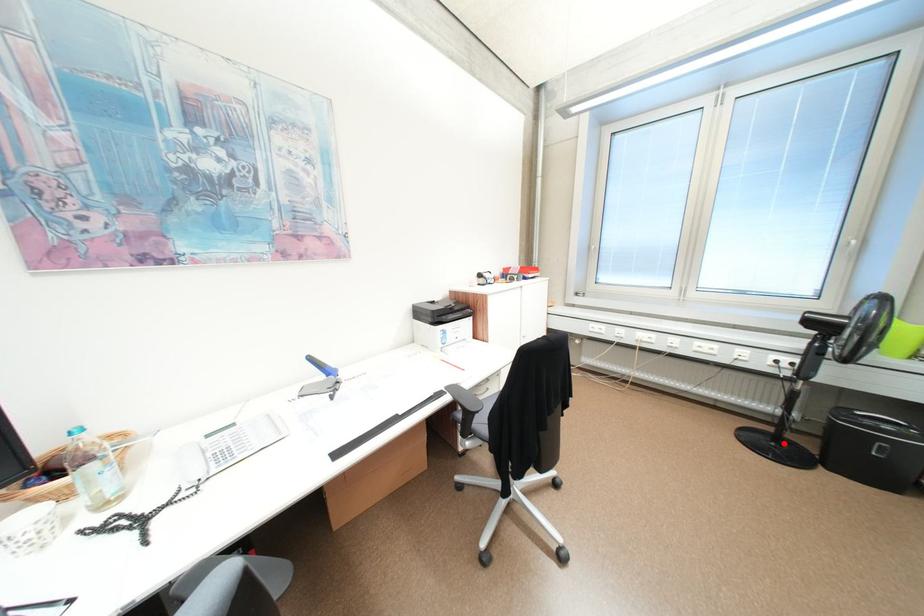
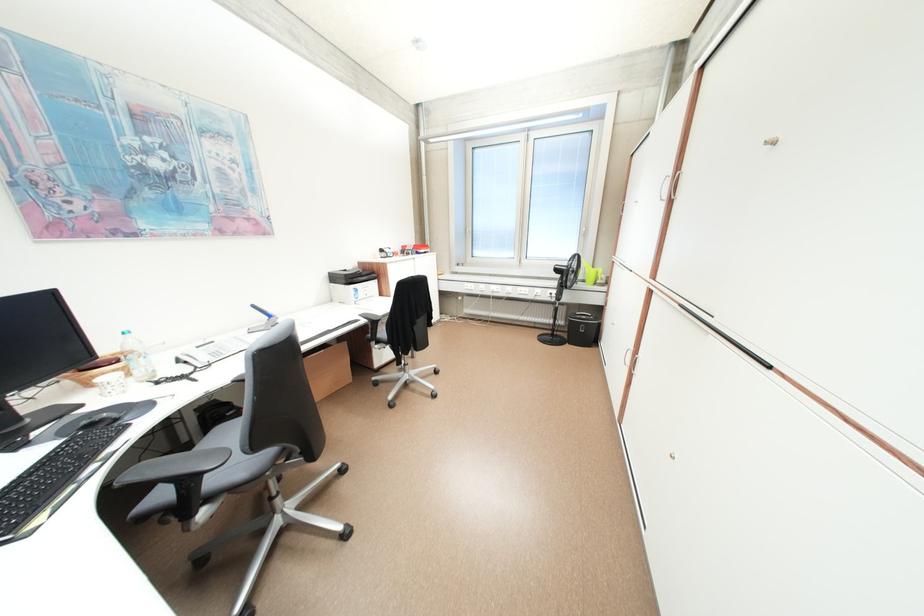
Question: I am providing you with two images of the same scene from different viewpoints. Given a red point in image1, look at the same physical point in image2. Is it:

Choices:
 (A) Closer to the viewpoint
 (B) Farther from the viewpoint

Answer: (A)